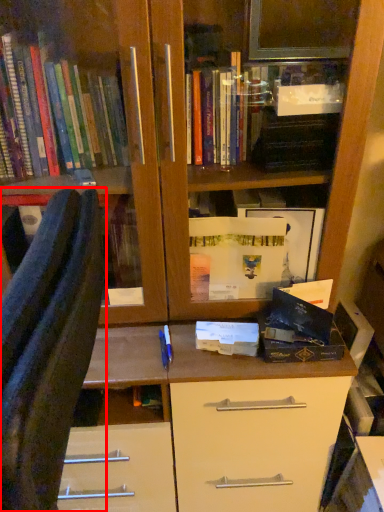
Question: From the image's perspective, where is furniture (annotated by the red box) located in relation to paperback book in the image?

Choices:
 (A) above
 (B) below

Answer: (B)